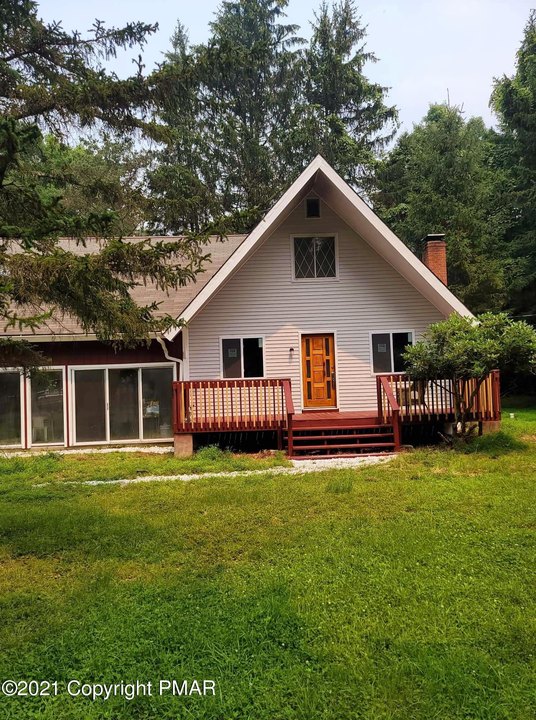
Find the location of a particular element. This screenshot has width=536, height=720. door handle is located at coordinates (333, 382).